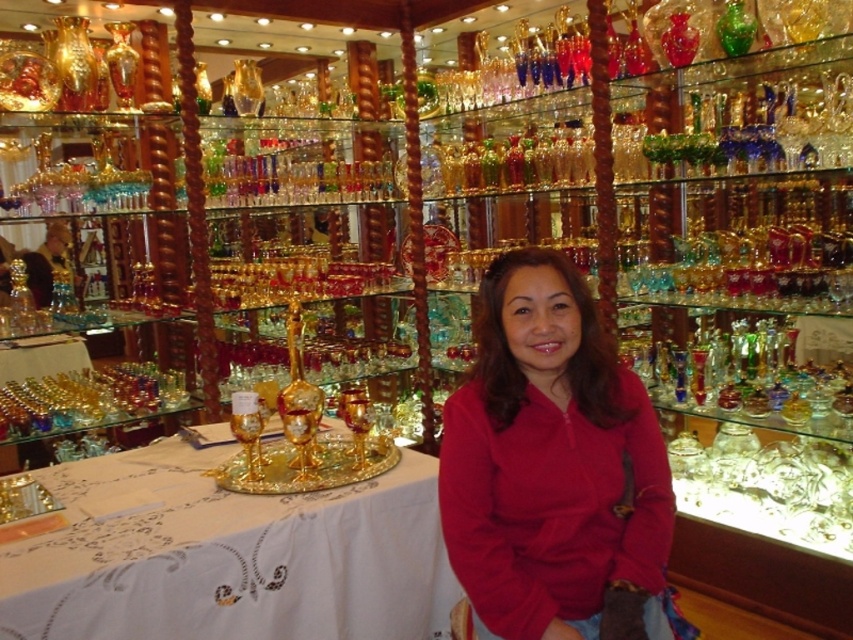
Which is in front, point (331, 561) or point (492, 600)?

Point (492, 600) is in front.

Can you confirm if white embroidered tablecloth at center is positioned below matte red sweater at center?

Indeed, white embroidered tablecloth at center is positioned under matte red sweater at center.

Where is `white embroidered tablecloth at center`? white embroidered tablecloth at center is located at coordinates (229, 556).